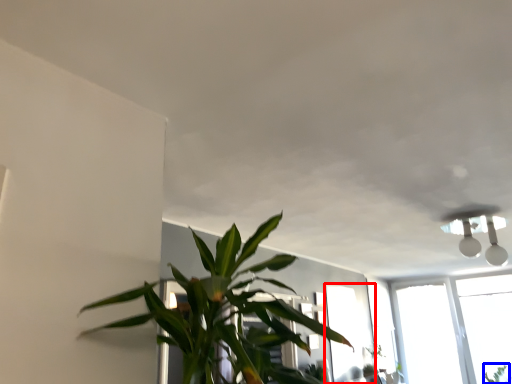
Question: Which object appears farthest to the camera in this image, window (highlighted by a red box) or plant (highlighted by a blue box)?

Choices:
 (A) window
 (B) plant

Answer: (B)